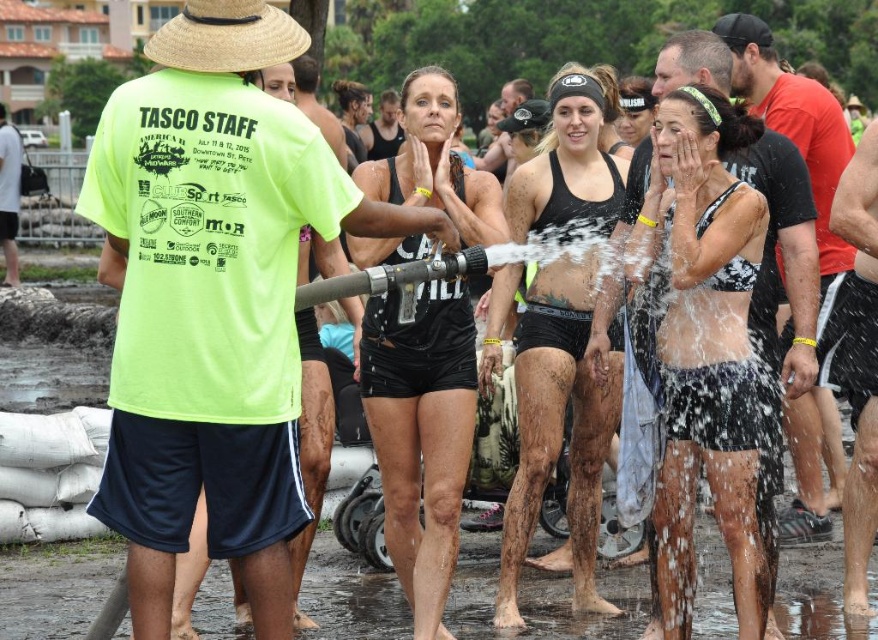
You are standing at point (227, 221) and want to walk to point (837, 237). Which direction should you move first?

You should move backward first because point (227, 221) is in front of point (837, 237).

You are a photographer positioned at the back of the scene. You need to capture a photo that includes both the black matte shorts at center and the straw hat at upper left. Based on their positions, which object should you adjust your camera to focus on first to ensure both are in frame?

Since the black matte shorts at center is to the right of the straw hat at upper left, you should first focus on the straw hat at upper left to ensure it is included in the frame before adjusting to include the black matte shorts at center on the right side.